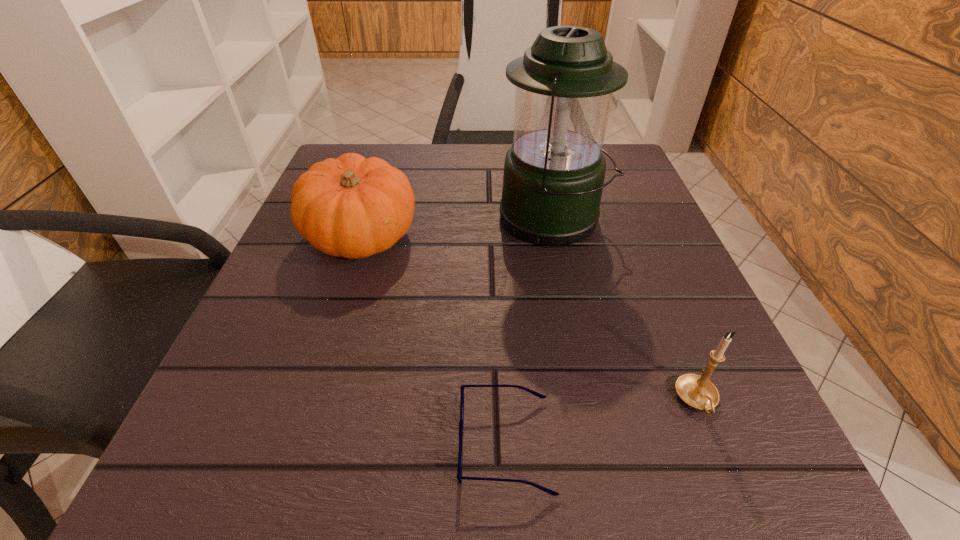
Identify the location of lantern. (554, 172).

Locate an element on the screen. pumpkin is located at coordinates (352, 207).

The image size is (960, 540). Find the location of `candle holder`. candle holder is located at coordinates (697, 391).

Find the location of a particular element. The width and height of the screenshot is (960, 540). the shortest object is located at coordinates (459, 475).

Where is `vacant area situated 0.240m on the front of the lantern`? Image resolution: width=960 pixels, height=540 pixels. vacant area situated 0.240m on the front of the lantern is located at coordinates (584, 365).

You are a GUI agent. You are given a task and a screenshot of the screen. Output one action in this format:
    pyautogui.click(x=<x>, y=<y>)
    Task: Click on the vacant space located on the front of the pumpkin
    
    Given the screenshot: What is the action you would take?
    pyautogui.click(x=309, y=396)

Locate an element on the screen. This screenshot has height=540, width=960. free spot located on the handle side of the candle holder is located at coordinates (731, 484).

The height and width of the screenshot is (540, 960). What are the coordinates of `free space located 0.230m on the front-facing side of the shortest object` in the screenshot? It's located at (264, 444).

The height and width of the screenshot is (540, 960). What are the coordinates of `blank area located 0.320m on the front-facing side of the shortest object` in the screenshot? It's located at (187, 444).

This screenshot has width=960, height=540. Find the location of `free space located on the front-facing side of the shortest object`. free space located on the front-facing side of the shortest object is located at coordinates (366, 444).